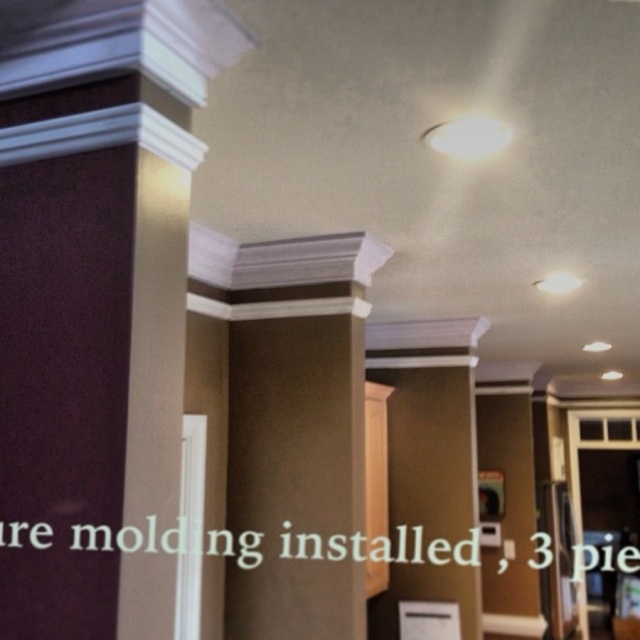
Does white glossy column at upper left have a lesser width compared to white glossy crown molding at upper center?

Correct, white glossy column at upper left's width is less than white glossy crown molding at upper center's.

Is white glossy column at upper left further to camera compared to white glossy crown molding at upper center?

No.

Does point (44, 80) come closer to viewer compared to point (228, 376)?

Yes, point (44, 80) is closer to viewer.

Find the location of `white glossy column at upper left`. white glossy column at upper left is located at coordinates (93, 294).